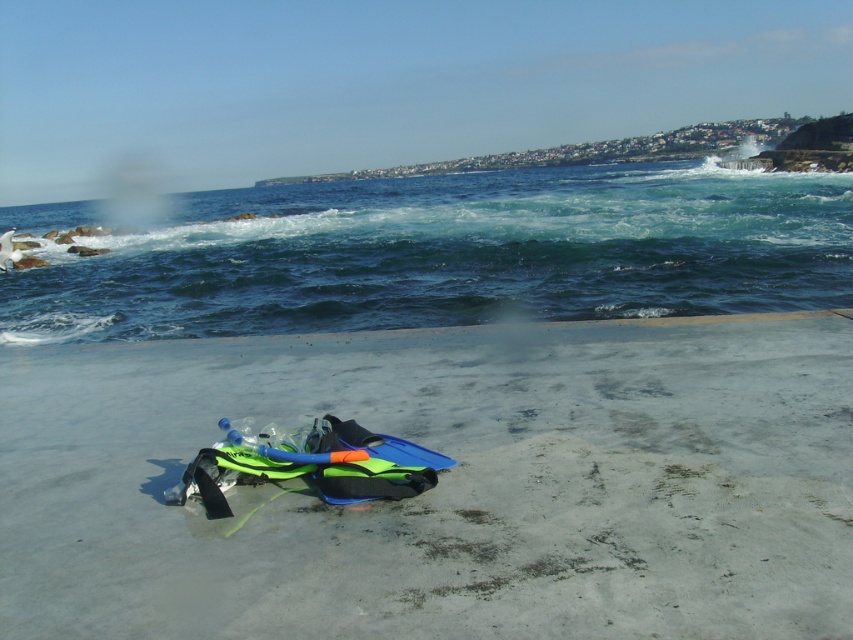
You are standing at the point labeled point (82, 512) and want to walk to the point labeled point (457, 204). Given the coastal terrain described, is there any obstruction between these two points that might hinder your path?

The point labeled point (82, 512) is in front of point (457, 204), so there is no obstruction between them. You can walk directly from point (82, 512) to point (457, 204) without any hindrance.